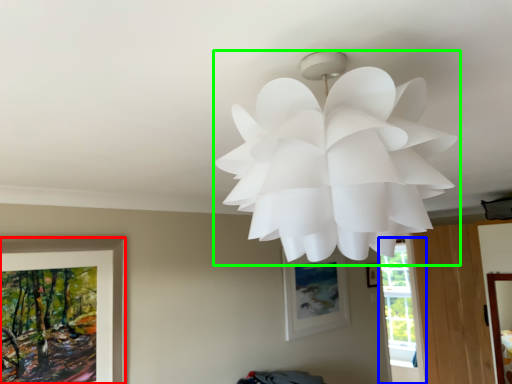
Question: Considering the real-world distances, which object is closest to picture frame (highlighted by a red box)? window (highlighted by a blue box) or lamp (highlighted by a green box).

Choices:
 (A) window
 (B) lamp

Answer: (B)